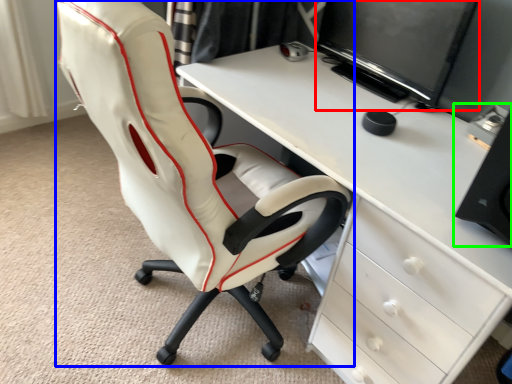
Question: Which object is the closest to the computer monitor (highlighted by a red box)? Choose among these: chair (highlighted by a blue box) or computer tower (highlighted by a green box).

Choices:
 (A) chair
 (B) computer tower

Answer: (B)